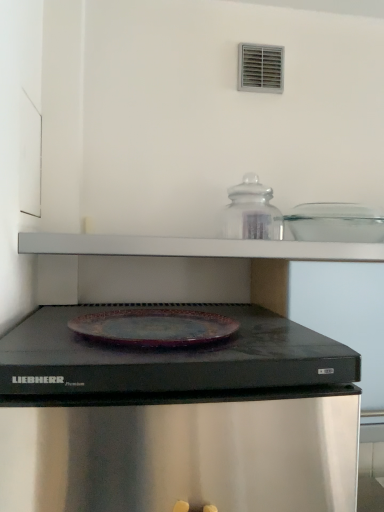
Question: Considering their positions, is transparent glass jar at upper center, the 1th appliance positioned from the left, located in front of or behind clear glass jar at upper center, which is the second appliance from left to right?

Choices:
 (A) front
 (B) behind

Answer: (B)

Question: Would you say transparent glass jar at upper center, placed as the second appliance when sorted from right to left, is to the left or to the right of clear glass jar at upper center, the 1th appliance from the right, in the picture?

Choices:
 (A) left
 (B) right

Answer: (A)

Question: From the image's perspective, is transparent glass jar at upper center, the 1th appliance positioned from the left, positioned above or below clear glass jar at upper center, which is the second appliance from left to right?

Choices:
 (A) above
 (B) below

Answer: (A)

Question: Would you say clear glass jar at upper center, which is the second appliance from left to right, is inside or outside transparent glass jar at upper center, the 1th appliance positioned from the left?

Choices:
 (A) outside
 (B) inside

Answer: (A)

Question: Looking at the image, does clear glass jar at upper center, which is the second appliance from left to right, seem bigger or smaller compared to transparent glass jar at upper center, the 1th appliance positioned from the left?

Choices:
 (A) small
 (B) big

Answer: (B)

Question: Is clear glass jar at upper center, which is the second appliance from left to right, taller or shorter than transparent glass jar at upper center, placed as the second appliance when sorted from right to left?

Choices:
 (A) tall
 (B) short

Answer: (B)

Question: From a real-world perspective, is clear glass jar at upper center, which is the second appliance from left to right, above or below transparent glass jar at upper center, placed as the second appliance when sorted from right to left?

Choices:
 (A) below
 (B) above

Answer: (A)